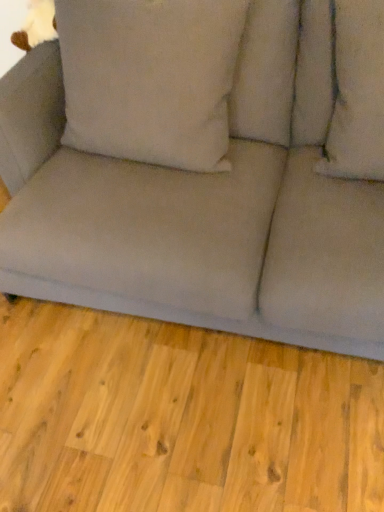
Question: Is matte gray couch at center thinner than soft beige cushion at upper right, which ranks as the second pillow in left-to-right order?

Choices:
 (A) yes
 (B) no

Answer: (B)

Question: From a real-world perspective, is matte gray couch at center beneath soft beige cushion at upper right, the first pillow positioned from the right?

Choices:
 (A) no
 (B) yes

Answer: (B)

Question: Considering the relative sizes of matte gray couch at center and soft beige cushion at upper right, which ranks as the second pillow in left-to-right order, in the image provided, is matte gray couch at center wider than soft beige cushion at upper right, which ranks as the second pillow in left-to-right order,?

Choices:
 (A) no
 (B) yes

Answer: (B)

Question: From the image's perspective, is matte gray couch at center over soft beige cushion at upper right, the first pillow positioned from the right?

Choices:
 (A) yes
 (B) no

Answer: (B)

Question: Is matte gray couch at center at the left side of soft beige cushion at upper right, which ranks as the second pillow in left-to-right order?

Choices:
 (A) yes
 (B) no

Answer: (A)

Question: Would you say gray fabric couch at lower center is to the left or to the right of beige fabric pillow at center, the second pillow from the right, in the picture?

Choices:
 (A) right
 (B) left

Answer: (B)

Question: Is gray fabric couch at lower center wider or thinner than beige fabric pillow at center, the second pillow from the right?

Choices:
 (A) thin
 (B) wide

Answer: (B)

Question: Is point (203, 345) closer or farther from the camera than point (89, 13)?

Choices:
 (A) closer
 (B) farther

Answer: (B)

Question: From a real-world perspective, is gray fabric couch at lower center above or below beige fabric pillow at center, which is counted as the first pillow, starting from the left?

Choices:
 (A) below
 (B) above

Answer: (A)

Question: Considering their positions, is beige fabric pillow at center, the second pillow from the right, located in front of or behind gray fabric couch at lower center?

Choices:
 (A) behind
 (B) front

Answer: (A)

Question: Do you think beige fabric pillow at center, which is counted as the first pillow, starting from the left, is within gray fabric couch at lower center, or outside of it?

Choices:
 (A) inside
 (B) outside

Answer: (B)

Question: Is beige fabric pillow at center, which is counted as the first pillow, starting from the left, taller or shorter than gray fabric couch at lower center?

Choices:
 (A) short
 (B) tall

Answer: (B)

Question: Would you say beige fabric pillow at center, the second pillow from the right, is to the left or to the right of gray fabric couch at lower center in the picture?

Choices:
 (A) left
 (B) right

Answer: (B)

Question: Would you say beige fabric pillow at center, which is counted as the first pillow, starting from the left, is to the left or to the right of soft beige cushion at upper right, the first pillow positioned from the right, in the picture?

Choices:
 (A) left
 (B) right

Answer: (A)

Question: From their relative heights in the image, would you say beige fabric pillow at center, which is counted as the first pillow, starting from the left, is taller or shorter than soft beige cushion at upper right, which ranks as the second pillow in left-to-right order?

Choices:
 (A) tall
 (B) short

Answer: (A)